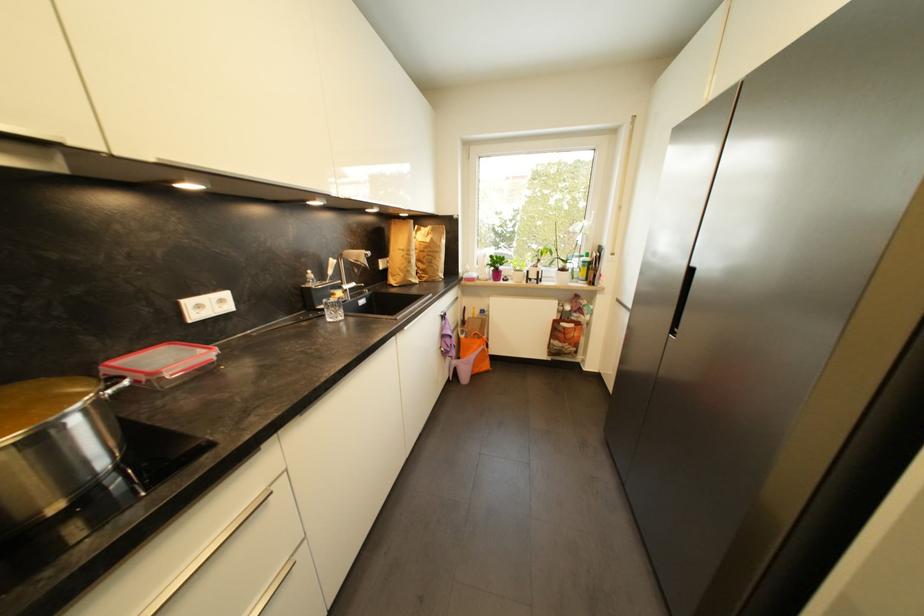
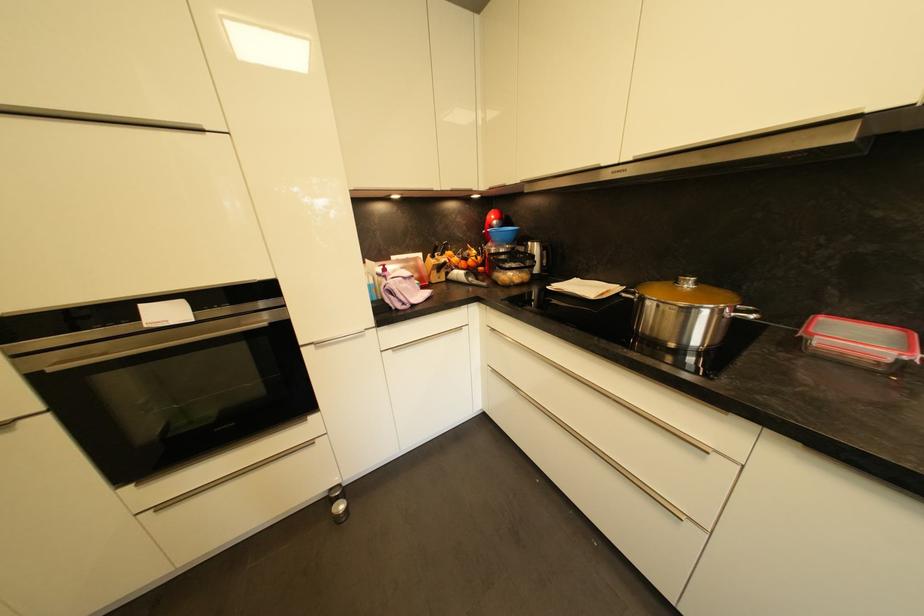
Find the pixel in the second image that matches [114,394] in the first image.

(737, 315)